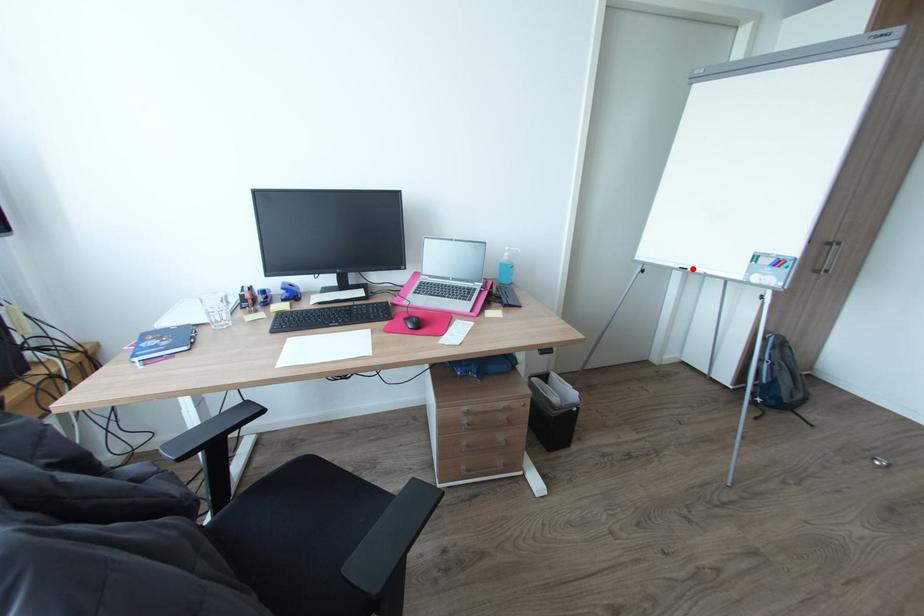
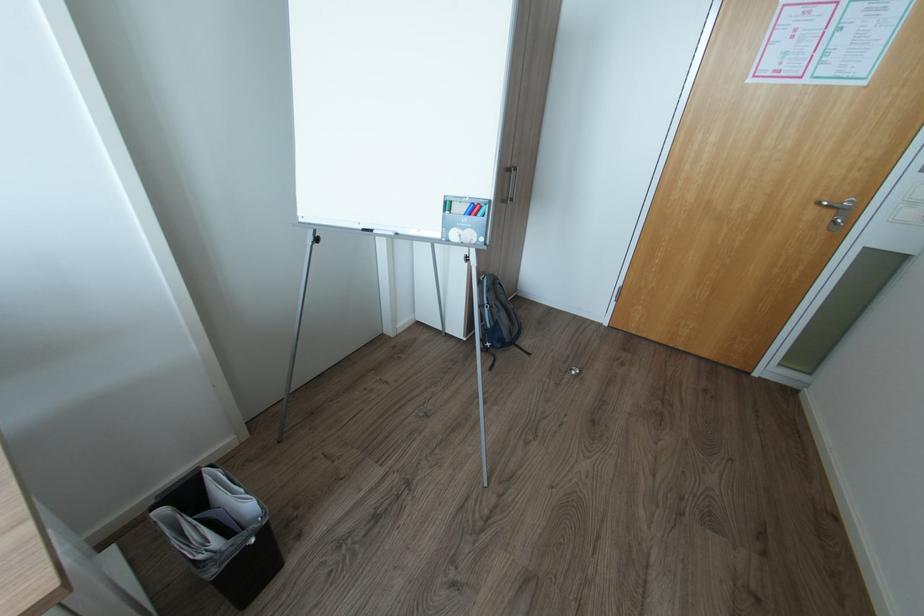
Question: I am providing you with two images of the same scene from different viewpoints. Given a red point in image1, look at the same physical point in image2. Is it:

Choices:
 (A) Closer to the viewpoint
 (B) Farther from the viewpoint

Answer: (B)